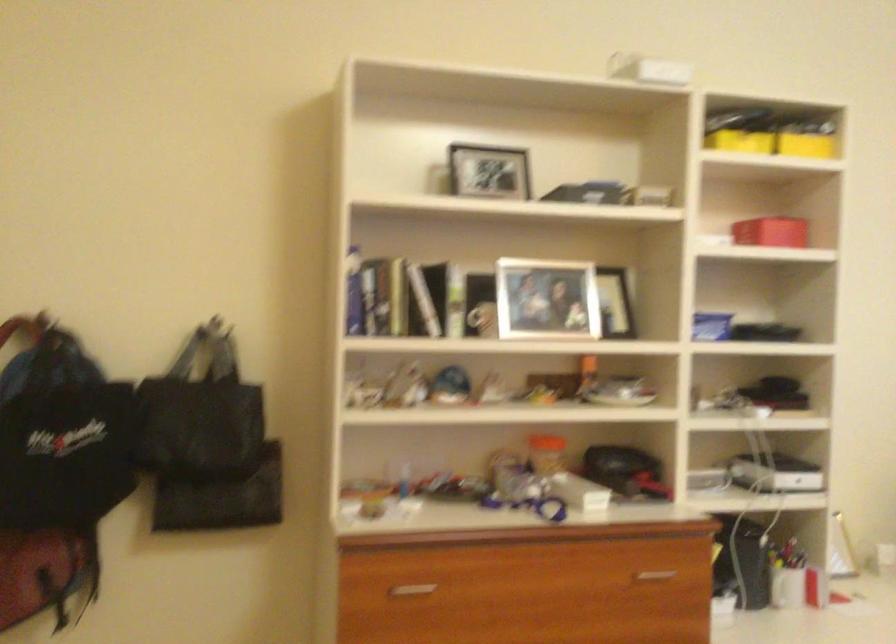
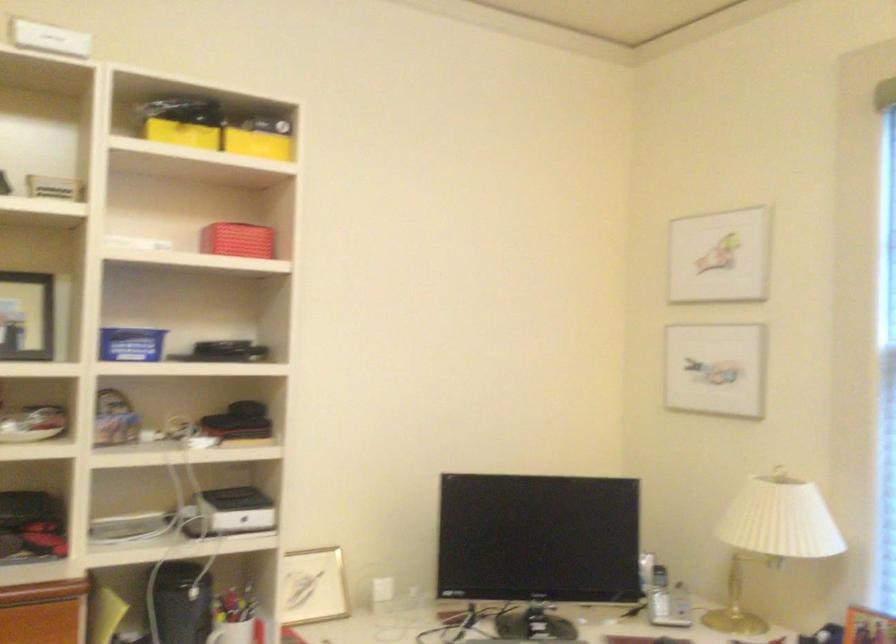
In the second image, find the point that corresponds to (x=739, y=140) in the first image.

(182, 134)